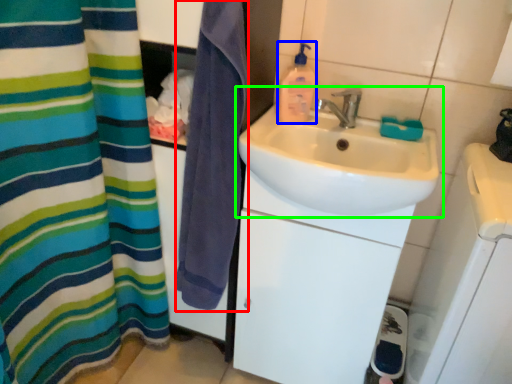
Question: Estimate the real-world distances between objects in this image. Which object is farther from beach towel (highlighted by a red box), cleaning product (highlighted by a blue box) or sink (highlighted by a green box)?

Choices:
 (A) cleaning product
 (B) sink

Answer: (A)